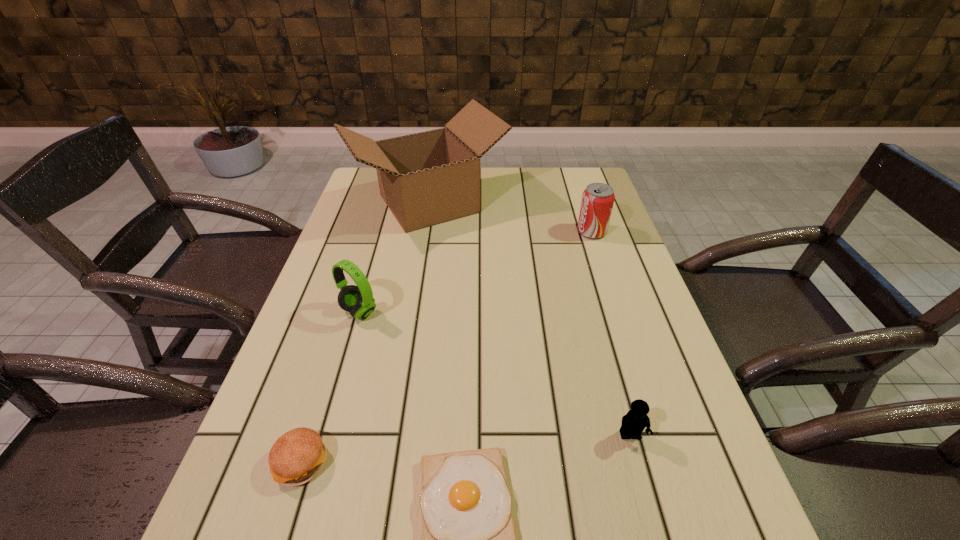
Locate an element on the screen. This screenshot has height=540, width=960. the tallest object is located at coordinates click(x=428, y=178).

In order to click on soda can in this screenshot , I will do `click(597, 202)`.

Locate an element on the screen. This screenshot has width=960, height=540. headset is located at coordinates pos(358,300).

Find the location of a particular element. Lego is located at coordinates (634, 422).

I want to click on hamburger, so click(x=297, y=456).

Where is `free point located 0.230m on the front of the box`? free point located 0.230m on the front of the box is located at coordinates (414, 299).

Image resolution: width=960 pixels, height=540 pixels. I want to click on vacant space located on the left of the soda can, so click(458, 232).

Find the location of a particular element. This screenshot has width=960, height=540. free space located on the front of the headset is located at coordinates click(x=334, y=397).

This screenshot has width=960, height=540. I want to click on free space located 0.070m on the front-facing side of the Lego, so click(643, 485).

Locate an element on the screen. vacant area located 0.250m on the back of the fifth tallest object is located at coordinates (341, 335).